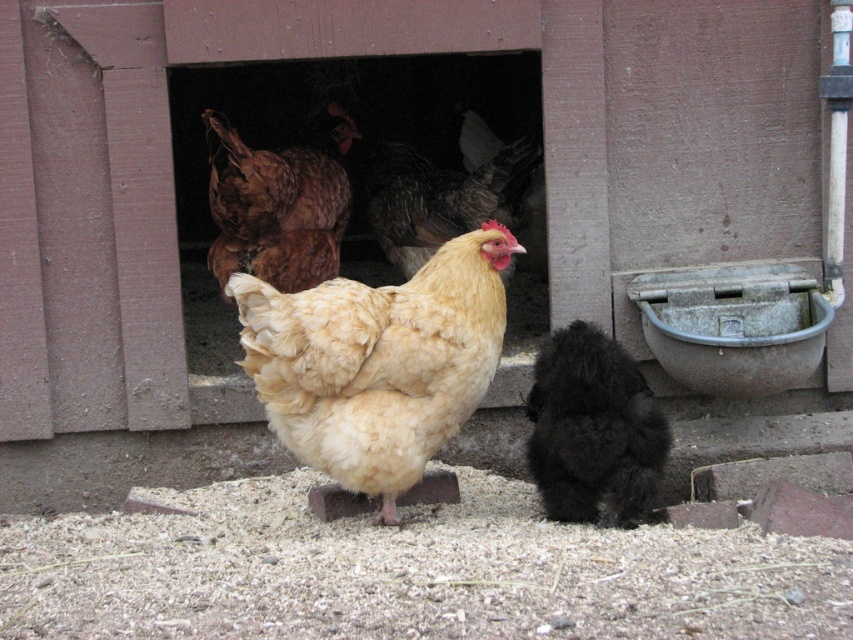
You are a farmer checking the chickens. You notice the black fluffy chicken at lower center and the brown feathered chicken at upper center. Which chicken is shorter?

The black fluffy chicken at lower center is shorter than the brown feathered chicken at upper center.

Where is the golden feathered chicken at center located in the image?

The golden feathered chicken at center is located at point (378, 362) in the image.

You are a farmer checking on your chickens. You notice the golden feathered chicken at center and the black fluffy chicken at lower center. Which chicken is closer to you?

The golden feathered chicken at center is closer to you because it is in front of the black fluffy chicken at lower center.